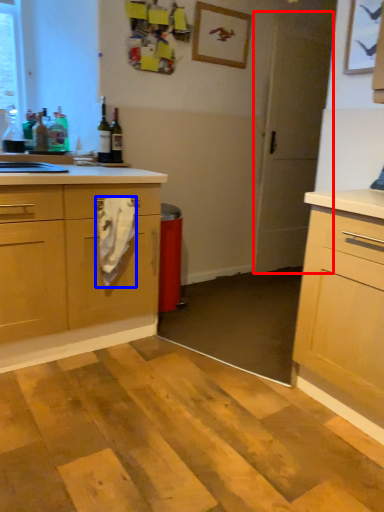
Question: Which of the following is the farthest to the observer, screen door (highlighted by a red box) or material (highlighted by a blue box)?

Choices:
 (A) screen door
 (B) material

Answer: (A)